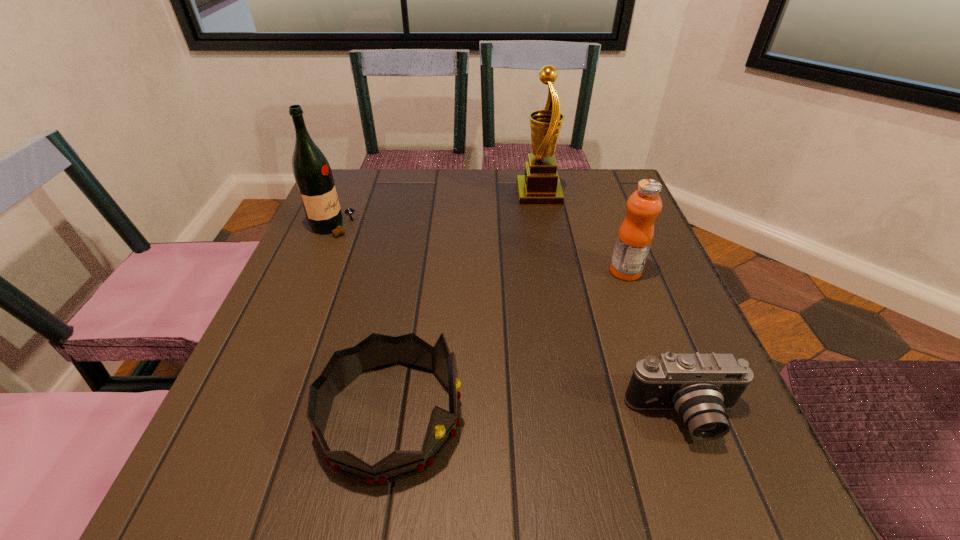
The width and height of the screenshot is (960, 540). Find the location of `the farthest object`. the farthest object is located at coordinates pos(540,186).

The width and height of the screenshot is (960, 540). Identify the location of the third object from right to left. (540, 186).

Where is `the fourth nearest object`? The image size is (960, 540). the fourth nearest object is located at coordinates (311, 170).

Locate an element on the screen. The image size is (960, 540). wine bottle is located at coordinates (311, 170).

You are a GUI agent. You are given a task and a screenshot of the screen. Output one action in this format:
    pyautogui.click(x=<x>, y=<y>)
    Task: Click on the third shortest object
    Image resolution: width=960 pixels, height=540 pixels.
    Given the screenshot: What is the action you would take?
    pyautogui.click(x=643, y=206)

I want to click on the third farthest object, so click(x=643, y=206).

Find the location of a particular element. This screenshot has height=540, width=960. tiara is located at coordinates (376, 351).

The height and width of the screenshot is (540, 960). What are the coordinates of `the second object from left to right` in the screenshot? It's located at (376, 351).

Where is `camera`? camera is located at coordinates click(x=700, y=387).

The image size is (960, 540). I want to click on vacant area located on the front-facing side of the third object from right to left, so click(415, 194).